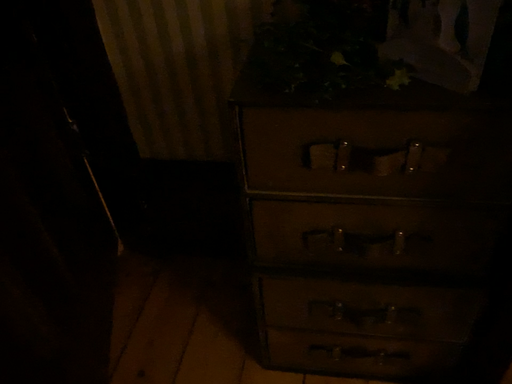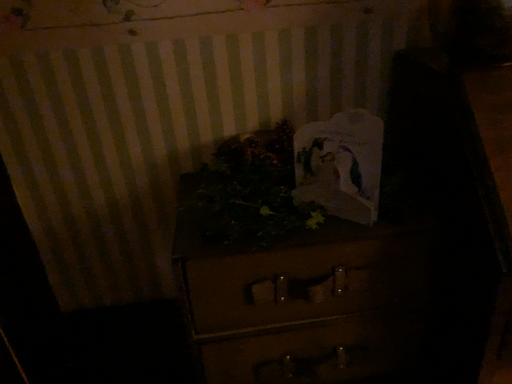
Question: How did the camera likely rotate when shooting the video?

Choices:
 (A) rotated right
 (B) rotated left

Answer: (A)